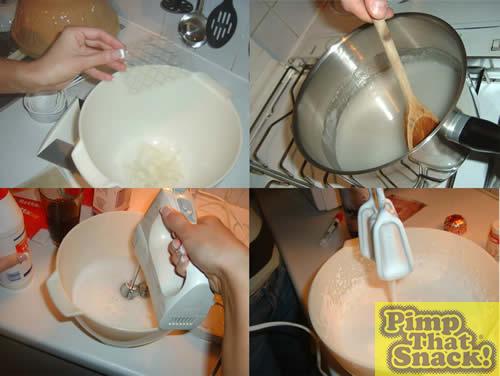
Where is `pot`? This screenshot has width=500, height=376. pot is located at coordinates (365, 80).